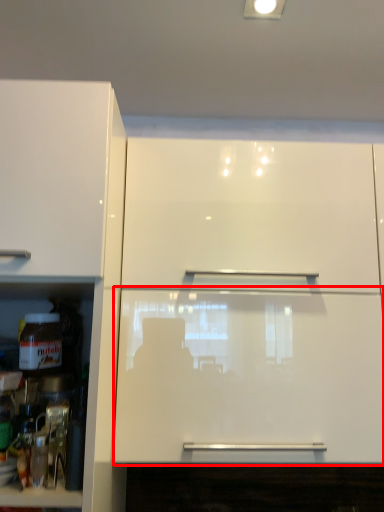
Question: From the image's perspective, considering the relative positions of glass door (annotated by the red box) and cabinetry in the image provided, where is glass door (annotated by the red box) located with respect to the staircase?

Choices:
 (A) below
 (B) above

Answer: (B)